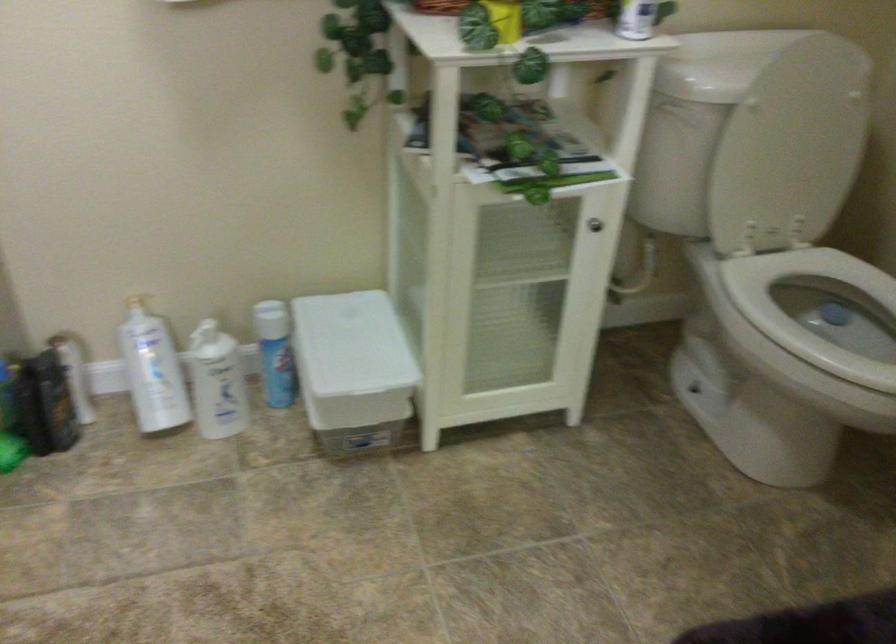
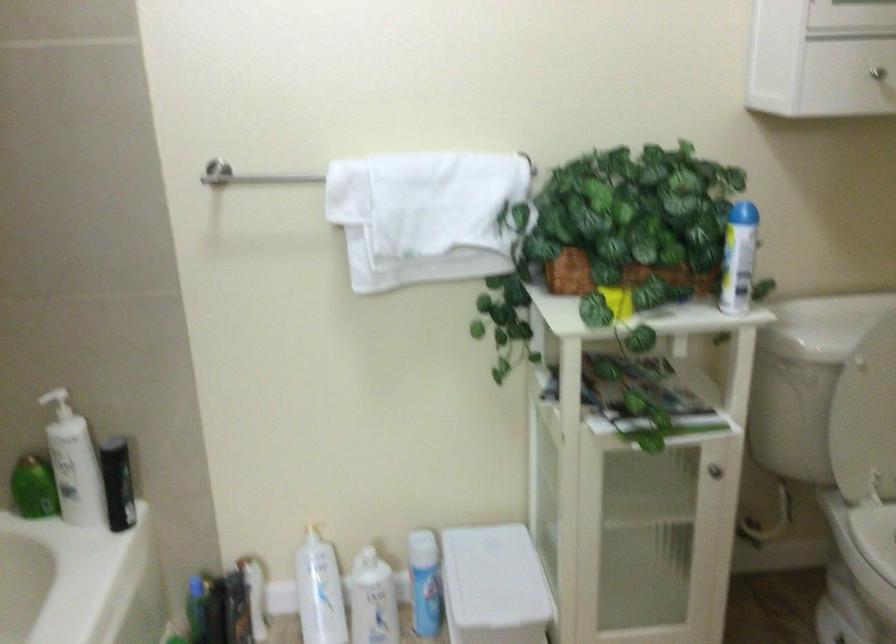
Locate, in the second image, the point that corresponds to [597,225] in the first image.

(713, 469)